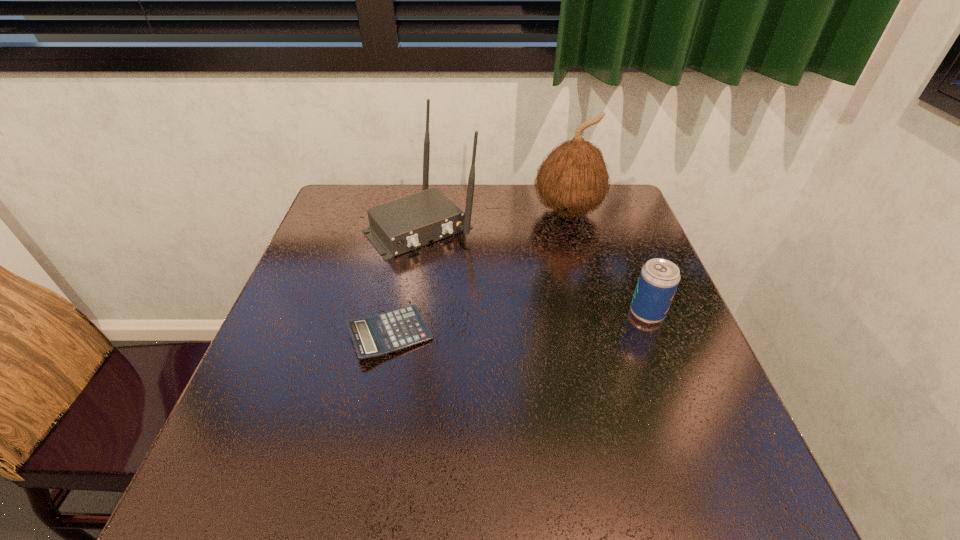
Identify the location of free space located on the surface of the coconut. The width and height of the screenshot is (960, 540). (562, 283).

Image resolution: width=960 pixels, height=540 pixels. What are the coordinates of `free space located on the surface of the coconut` in the screenshot? It's located at (564, 250).

Identify the location of router present at the far edge. The image size is (960, 540). (398, 226).

I want to click on coconut that is positioned at the far edge, so click(x=573, y=179).

At what (x,y) coordinates should I click in order to perform the action: click on object that is at the left edge. Please return your answer as a coordinate pair (x, y). The image size is (960, 540). Looking at the image, I should click on (398, 226).

At what (x,y) coordinates should I click in order to perform the action: click on beer can at the right edge. Please return your answer as a coordinate pair (x, y). The height and width of the screenshot is (540, 960). Looking at the image, I should click on (659, 278).

Locate an element on the screen. This screenshot has width=960, height=540. coconut present at the right edge is located at coordinates (573, 179).

The height and width of the screenshot is (540, 960). What are the coordinates of `object at the far left corner` in the screenshot? It's located at (398, 226).

Locate an element on the screen. This screenshot has width=960, height=540. object positioned at the far right corner is located at coordinates (573, 179).

At what (x,y) coordinates should I click in order to perform the action: click on vacant space at the far edge of the desktop. Please return your answer as a coordinate pair (x, y). This screenshot has width=960, height=540. Looking at the image, I should click on click(540, 214).